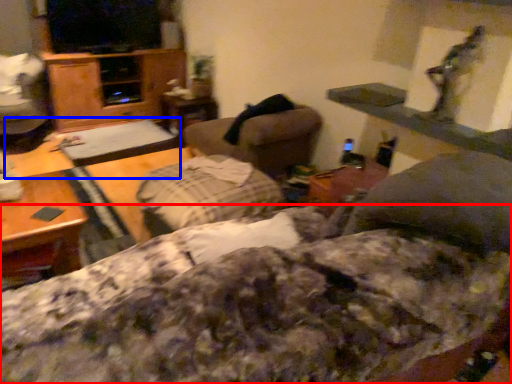
Question: Which of the following is the closest to the observer, bedding (highlighted by a red box) or table (highlighted by a blue box)?

Choices:
 (A) bedding
 (B) table

Answer: (A)